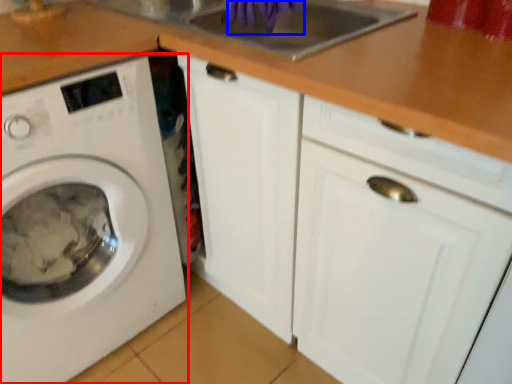
Question: Which of the following is the farthest to the observer, washing machine (highlighted by a red box) or hand (highlighted by a blue box)?

Choices:
 (A) washing machine
 (B) hand

Answer: (B)